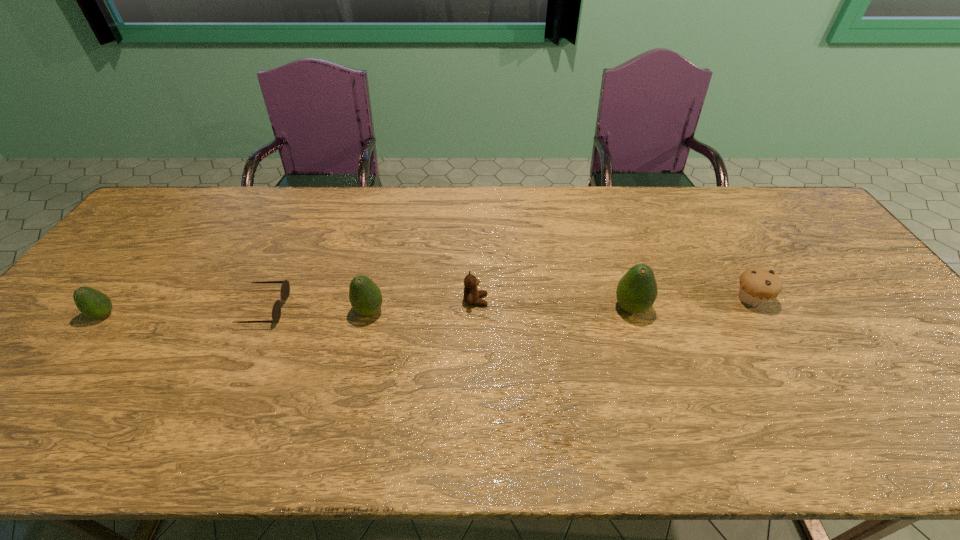
Where is `vacant space at the far left corner of the desktop`? vacant space at the far left corner of the desktop is located at coordinates (176, 201).

Locate an element on the screen. This screenshot has width=960, height=540. vacant area at the far right corner of the desktop is located at coordinates (765, 188).

Find the location of a particular element. vacant region at the near right corner of the desktop is located at coordinates tap(931, 398).

What are the coordinates of `free space between the rightmost object and the second object from right to left` in the screenshot? It's located at (690, 303).

I want to click on free space between the rightmost object and the second avocado from right to left, so click(x=560, y=306).

Find the location of `vacant area that lies between the shortest avocado and the second avocado from left to right`. vacant area that lies between the shortest avocado and the second avocado from left to right is located at coordinates coord(237,313).

In order to click on vacant space that's between the rightmost object and the fourth object from left to right in this screenshot , I will do `click(613, 300)`.

Locate an element on the screen. Image resolution: width=960 pixels, height=540 pixels. free space between the muffin and the second object from left to right is located at coordinates (508, 303).

The height and width of the screenshot is (540, 960). I want to click on unoccupied position between the second object from left to right and the second avocado from left to right, so click(x=318, y=310).

Image resolution: width=960 pixels, height=540 pixels. I want to click on vacant region between the rightmost avocado and the shortest object, so click(x=448, y=308).